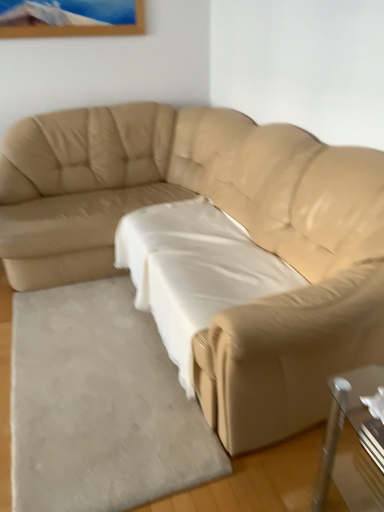
Question: From the image's perspective, is white soft rug at lower left below beige leather couch at center?

Choices:
 (A) no
 (B) yes

Answer: (B)

Question: Would you consider white soft rug at lower left to be distant from beige leather couch at center?

Choices:
 (A) yes
 (B) no

Answer: (B)

Question: Is white soft rug at lower left completely or partially outside of beige leather couch at center?

Choices:
 (A) no
 (B) yes

Answer: (A)

Question: Considering the relative positions of white soft rug at lower left and beige leather couch at center in the image provided, is white soft rug at lower left to the right of beige leather couch at center from the viewer's perspective?

Choices:
 (A) yes
 (B) no

Answer: (B)

Question: Is white soft rug at lower left oriented towards beige leather couch at center?

Choices:
 (A) yes
 (B) no

Answer: (A)

Question: Is white fabric sheet at center inside or outside of beige leather couch at center?

Choices:
 (A) outside
 (B) inside

Answer: (B)

Question: Is white fabric sheet at center in front of or behind beige leather couch at center in the image?

Choices:
 (A) behind
 (B) front

Answer: (A)

Question: From a real-world perspective, is white fabric sheet at center above or below beige leather couch at center?

Choices:
 (A) above
 (B) below

Answer: (B)

Question: From the image's perspective, is white fabric sheet at center positioned above or below beige leather couch at center?

Choices:
 (A) above
 (B) below

Answer: (B)

Question: Is beige leather couch at center bigger or smaller than white soft rug at lower left?

Choices:
 (A) big
 (B) small

Answer: (A)

Question: In terms of width, does beige leather couch at center look wider or thinner when compared to white soft rug at lower left?

Choices:
 (A) thin
 (B) wide

Answer: (B)

Question: Is point click(230, 433) closer or farther from the camera than point click(66, 444)?

Choices:
 (A) farther
 (B) closer

Answer: (B)

Question: Considering the positions of beige leather couch at center and white soft rug at lower left in the image, is beige leather couch at center taller or shorter than white soft rug at lower left?

Choices:
 (A) tall
 (B) short

Answer: (A)

Question: Would you say white soft rug at lower left is to the left or to the right of white fabric sheet at center in the picture?

Choices:
 (A) right
 (B) left

Answer: (B)

Question: From a real-world perspective, is white soft rug at lower left positioned above or below white fabric sheet at center?

Choices:
 (A) below
 (B) above

Answer: (A)